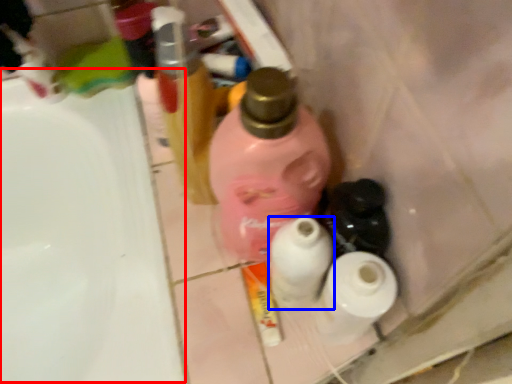
Question: Among these objects, which one is nearest to the camera, sink (highlighted by a red box) or toilet paper (highlighted by a blue box)?

Choices:
 (A) sink
 (B) toilet paper

Answer: (B)